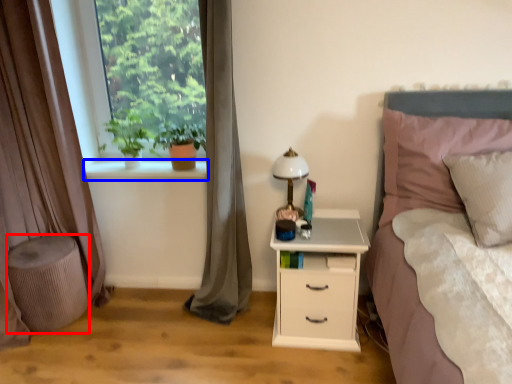
Question: Which of the following is the closest to the observer, stool (highlighted by a red box) or window sill (highlighted by a blue box)?

Choices:
 (A) stool
 (B) window sill

Answer: (A)